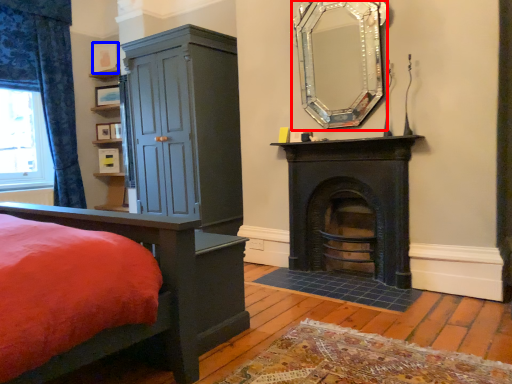
Question: Which of the following is the closest to the observer, fireplace (highlighted by a red box) or picture frame (highlighted by a blue box)?

Choices:
 (A) fireplace
 (B) picture frame

Answer: (A)